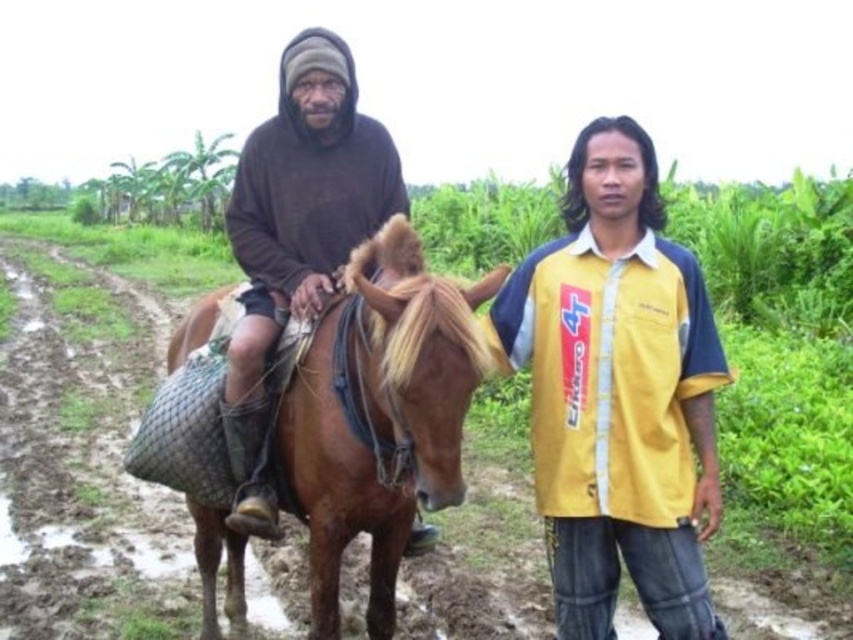
This screenshot has width=853, height=640. Identify the location of brown leather horse at left. (381, 416).

Is point (311, 429) behind point (315, 243)?

No, it is in front of (315, 243).

Who is more distant from viewer, (347, 284) or (306, 170)?

Positioned behind is point (306, 170).

I want to click on brown leather horse at left, so click(x=381, y=416).

Between point (622, 316) and point (347, 52), which one is positioned in front?

Positioned in front is point (622, 316).

The image size is (853, 640). I want to click on yellow fabric shirt at center, so click(x=618, y=394).

What are the coordinates of `brown mud track at lower left` in the screenshot? It's located at (84, 461).

Does brown mud track at lower left appear over brown leather horse at left?

No, brown mud track at lower left is not above brown leather horse at left.

Which is in front, point (144, 483) or point (297, 477)?

Point (297, 477) is more forward.

Find the location of a particular element. The width and height of the screenshot is (853, 640). brown mud track at lower left is located at coordinates (84, 461).